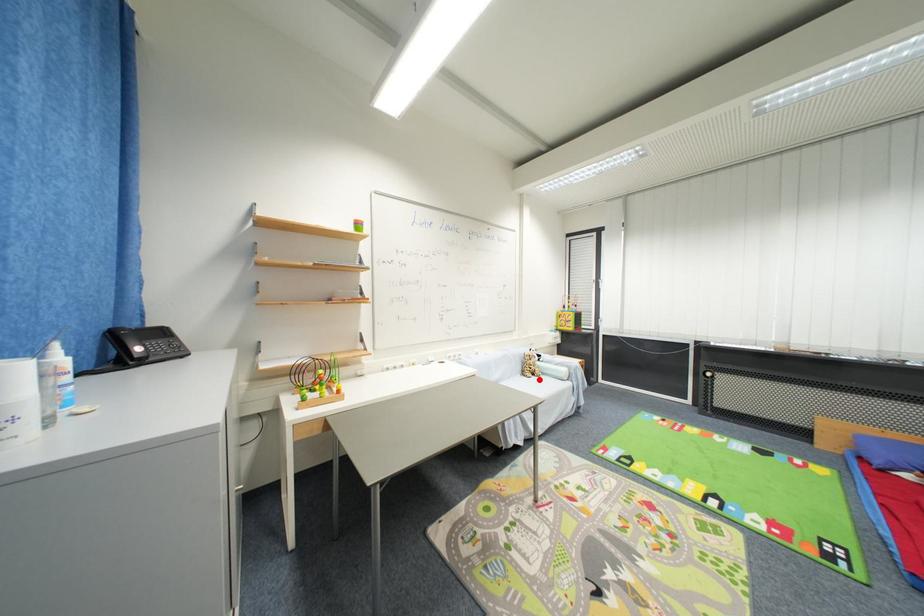
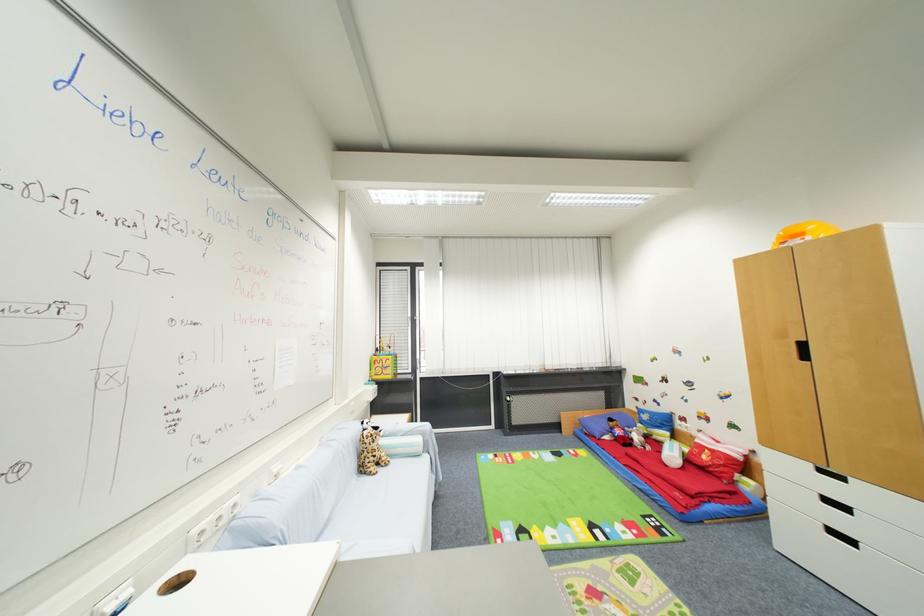
Question: I am providing you with two images of the same scene from different viewpoints. Given a red point in image1, look at the same physical point in image2. Is it:

Choices:
 (A) Closer to the viewpoint
 (B) Farther from the viewpoint

Answer: (A)